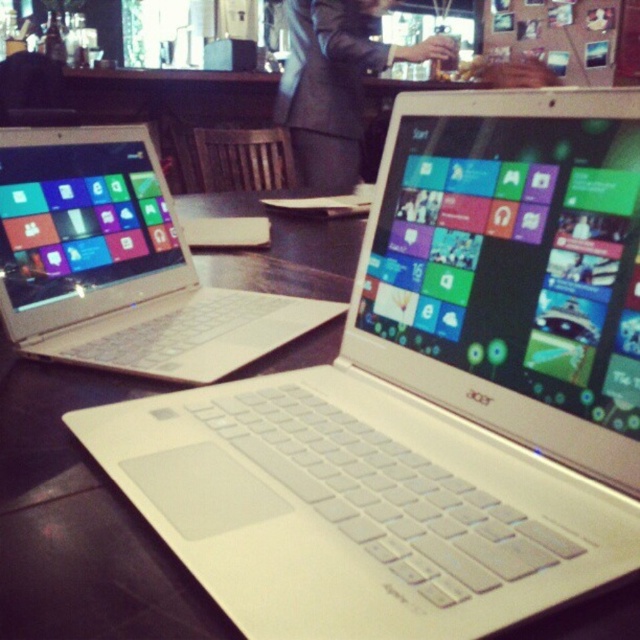
Question: Among these objects, which one is farthest from the camera?

Choices:
 (A) dark suit at center
 (B) white plastic laptop at left

Answer: (A)

Question: Is white plastic laptop at left smaller than dark suit at center?

Choices:
 (A) no
 (B) yes

Answer: (B)

Question: Is white plastic laptop at left further to the viewer compared to dark suit at center?

Choices:
 (A) no
 (B) yes

Answer: (A)

Question: Is white plastic laptop at left smaller than dark suit at center?

Choices:
 (A) yes
 (B) no

Answer: (A)

Question: Which object appears farthest from the camera in this image?

Choices:
 (A) dark suit at center
 (B) white plastic laptop at left

Answer: (A)